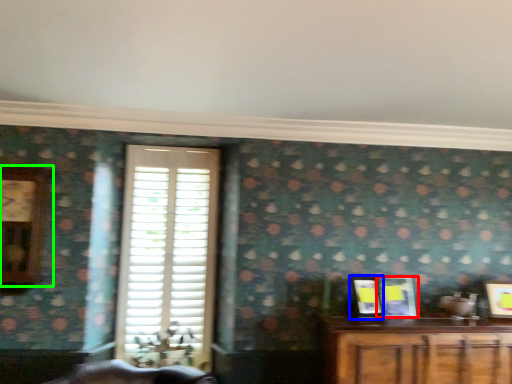
Question: Which object is positioned closest to picture frame (highlighted by a red box)? Select from picture frame (highlighted by a blue box) and clock (highlighted by a green box).

Choices:
 (A) picture frame
 (B) clock

Answer: (A)